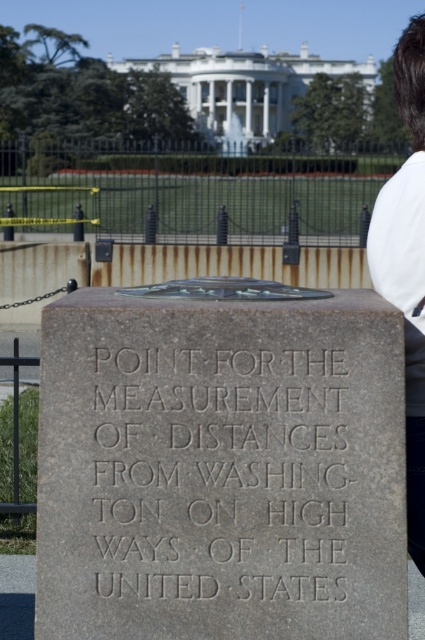
Question: Among these objects, which one is nearest to the camera?

Choices:
 (A) white fabric shirt at upper right
 (B) gray stone engraving at center

Answer: (A)

Question: Is gray stone engraving at center wider than white fabric shirt at upper right?

Choices:
 (A) yes
 (B) no

Answer: (A)

Question: Can you confirm if gray stone engraving at center is smaller than white fabric shirt at upper right?

Choices:
 (A) no
 (B) yes

Answer: (B)

Question: Considering the relative positions of gray stone engraving at center and white fabric shirt at upper right in the image provided, where is gray stone engraving at center located with respect to white fabric shirt at upper right?

Choices:
 (A) above
 (B) below

Answer: (B)

Question: Among these points, which one is nearest to the camera?

Choices:
 (A) (138, 544)
 (B) (382, 275)

Answer: (A)